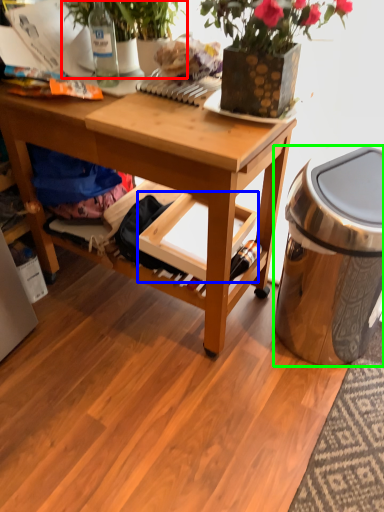
Question: Which object is positioned closest to houseplant (highlighted by a red box)? Select from shelf (highlighted by a blue box) and trash bin/can (highlighted by a green box).

Choices:
 (A) shelf
 (B) trash bin/can

Answer: (A)